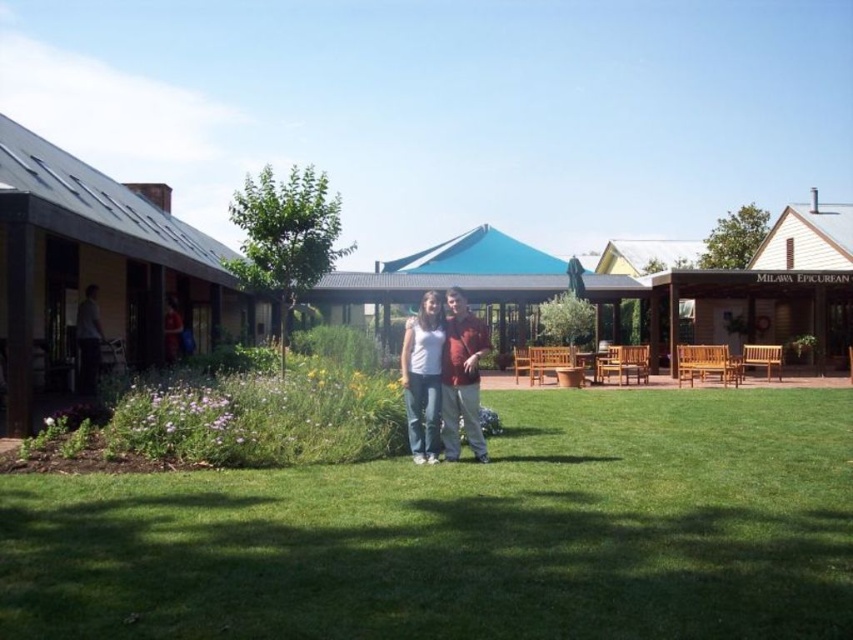
You are a photographer standing in the scene. You want to capture a photo where the green grass at center is visible in the background behind the matte gray shirt at left. Is this possible?

Yes, the green grass at center is located below the matte gray shirt at left, so positioning the matte gray shirt at left higher in the frame would allow the green grass at center to be seen behind it in the background.

You are standing at the camera position looking at the scene. There are two points marked in the image, point 1 at coordinates point (401, 369) and point 2 at coordinates point (94, 385). Which point is closer to you?

Point (401, 369) is closer to the camera than point (94, 385).

You are standing in the outdoor area and want to take a photo of the green grass at center and the matte white shirt at center. Which object should you focus on first to ensure both are in clear view?

You should focus on the green grass at center first since it is closer to the viewer than the matte white shirt at center, ensuring both are in focus when using a camera with depth of field considerations.